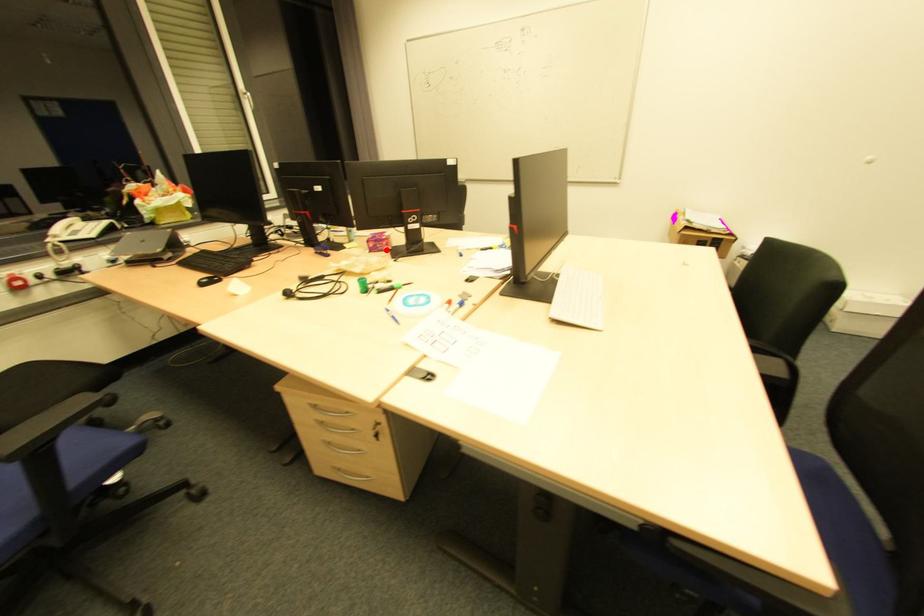
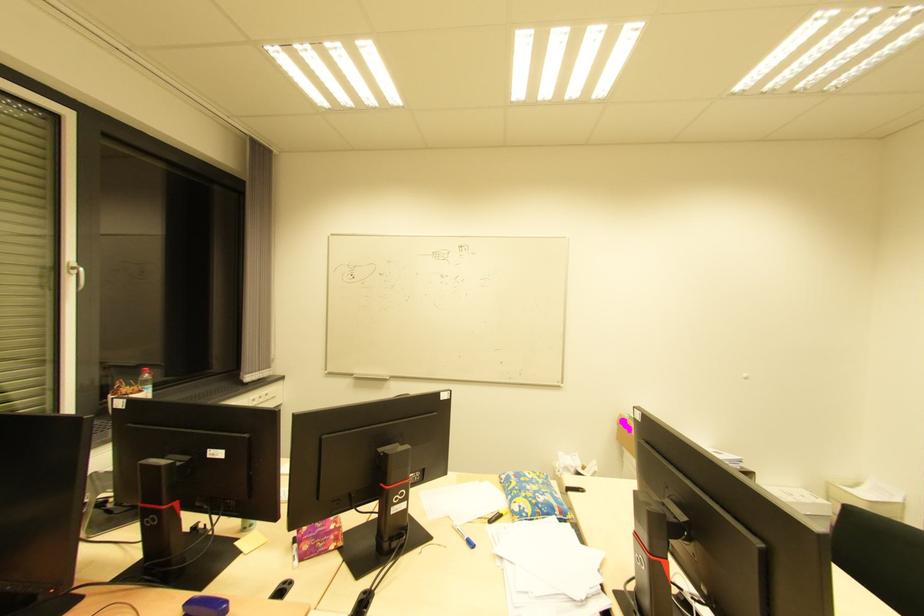
The point at the highlighted location is marked in the first image. Where is the corresponding point in the second image?

(332, 548)